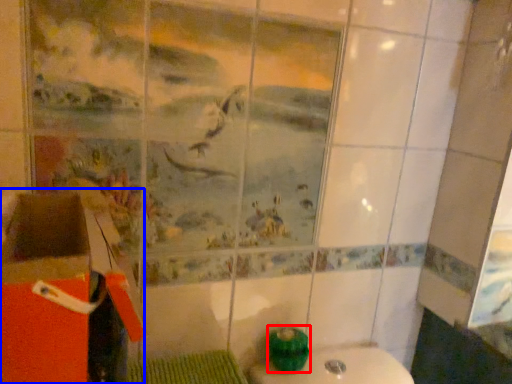
Question: Which point is further to the camera, teal (highlighted by a red box) or cardboard box (highlighted by a blue box)?

Choices:
 (A) teal
 (B) cardboard box

Answer: (A)